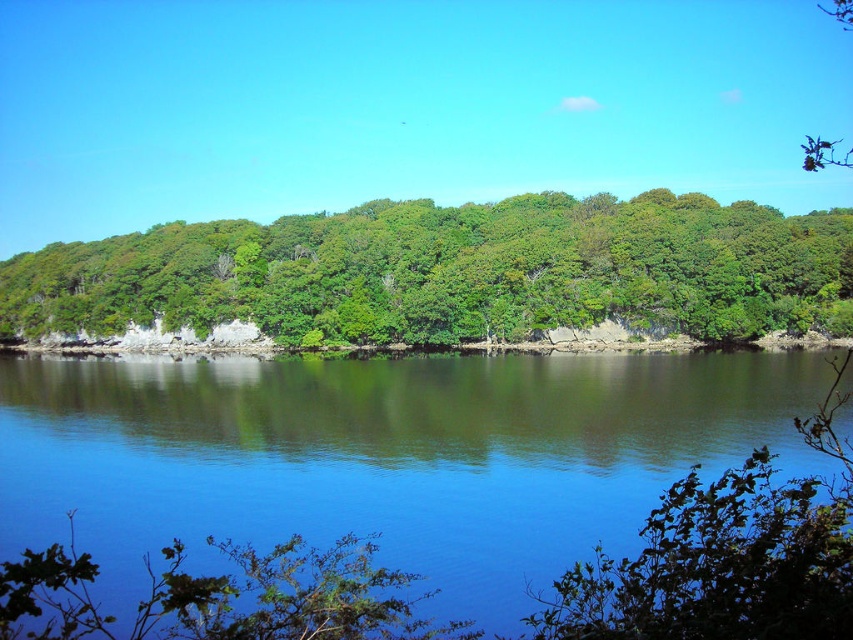
You are a photographer wanting to capture the smooth reflective water at center and the green leafy trees at center in a single shot. Which object should you focus on first if you want to ensure both are in sharp focus?

The smooth reflective water at center has a smaller size compared to green leafy trees at center, so you should focus on the green leafy trees at center first to ensure both are in sharp focus.

You are standing at the origin point in the image. Which direction should you move to reach the smooth reflective water at center?

The smooth reflective water at center is located at point 0.716 on the x axis and 0.453 on the y axis. Since you are at the origin, you should move towards the positive x and positive y directions to reach it.